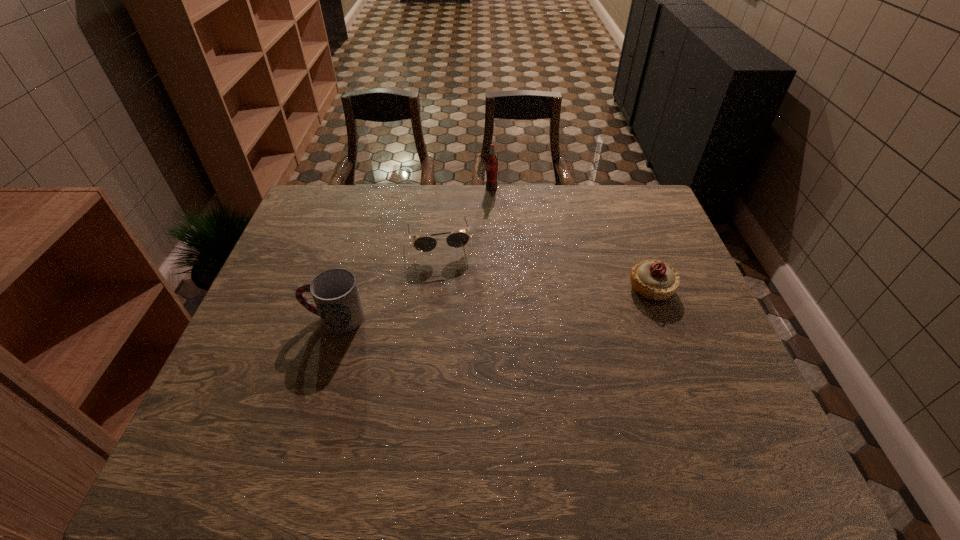
This screenshot has height=540, width=960. I want to click on the third shortest object, so click(335, 292).

Find the location of a particular element. The height and width of the screenshot is (540, 960). the leftmost object is located at coordinates (335, 292).

Find the location of `the rightmost object`. the rightmost object is located at coordinates (652, 279).

Where is `the second farthest object`? the second farthest object is located at coordinates (459, 239).

The height and width of the screenshot is (540, 960). Identify the location of the third object from right to left. (459, 239).

You are a GUI agent. You are given a task and a screenshot of the screen. Output one action in this format:
    pyautogui.click(x=<x>, y=<y>)
    Task: Click on the tallest object
    
    Given the screenshot: What is the action you would take?
    pyautogui.click(x=492, y=162)

This screenshot has width=960, height=540. What are the coordinates of `the second object from right to left` in the screenshot? It's located at pos(492,162).

The width and height of the screenshot is (960, 540). I want to click on free space located on the side of the third shortest object where the handle is located, so click(275, 318).

This screenshot has width=960, height=540. What are the coordinates of `free space located 0.100m on the side of the third shortest object where the handle is located` in the screenshot? It's located at [x=267, y=318].

In order to click on vacant area situated 0.130m on the side of the third shortest object where the handle is located in this screenshot , I will do `click(255, 318)`.